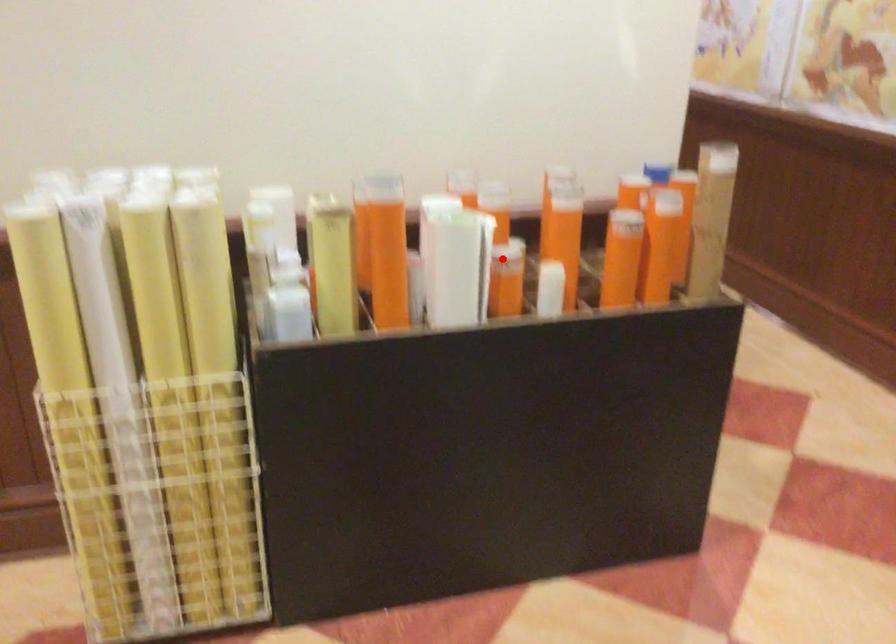
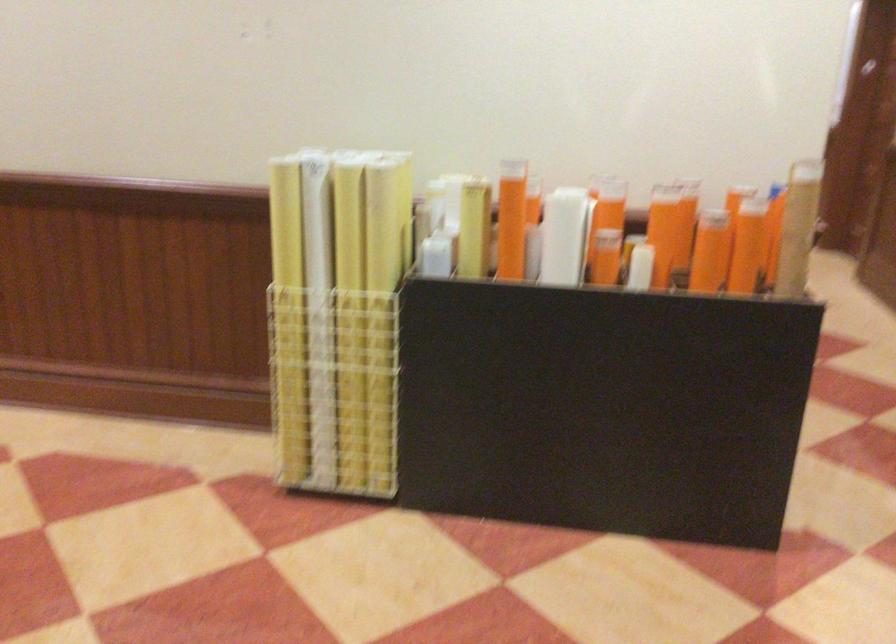
Question: I am providing you with two images of the same scene from different viewpoints. Image1 has a red point marked. In image2, the corresponding 3D location appears at what relative position? Reply with the corresponding letter.

Choices:
 (A) Closer
 (B) Farther

Answer: (B)